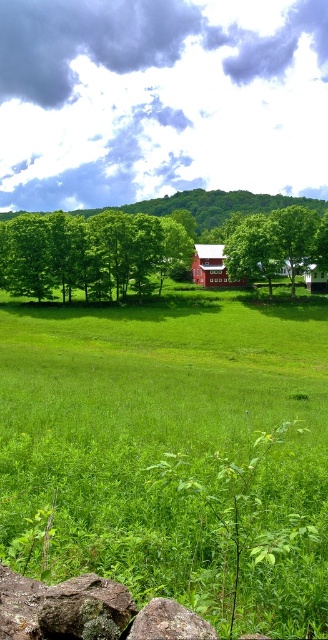
Who is higher up, rusty metallic rock at lower left or gray rough rock at lower center?

gray rough rock at lower center is higher up.

Locate an element on the screen. Image resolution: width=328 pixels, height=640 pixels. rusty metallic rock at lower left is located at coordinates (19, 605).

Where is `rusty metallic rock at lower left`? rusty metallic rock at lower left is located at coordinates (19, 605).

Between green leafy trees at center and red wooden barn at center, which one is positioned higher?

red wooden barn at center is above.

Is point (22, 276) closer to camera compared to point (214, 260)?

Yes, it is in front of point (214, 260).

Which is behind, point (49, 272) or point (196, 256)?

Point (196, 256)

Find the location of a particular element. green leafy trees at center is located at coordinates (87, 253).

Is green grassy field at center to the left of gray rough rock at lower center from the viewer's perspective?

Correct, you'll find green grassy field at center to the left of gray rough rock at lower center.

Is green grassy field at center closer to the viewer compared to gray rough rock at lower center?

No, it is not.

Who is more forward, [244,588] or [191,636]?

Point [191,636] is in front.

Identify the location of green grassy field at center. (168, 451).